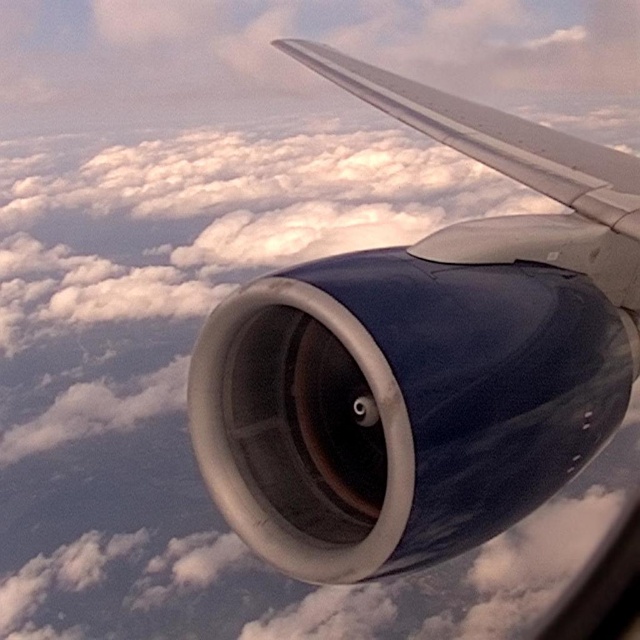
In the scene shown: Can you confirm if matte blue engine at center is thinner than metallic silver wing at upper right?

Indeed, matte blue engine at center has a lesser width compared to metallic silver wing at upper right.

Does matte blue engine at center appear under metallic silver wing at upper right?

Yes, matte blue engine at center is below metallic silver wing at upper right.

What do you see at coordinates (429, 355) in the screenshot?
I see `matte blue engine at center` at bounding box center [429, 355].

At what (x,y) coordinates should I click in order to perform the action: click on matte blue engine at center. Please return your answer as a coordinate pair (x, y). Image resolution: width=640 pixels, height=640 pixels. Looking at the image, I should click on (429, 355).